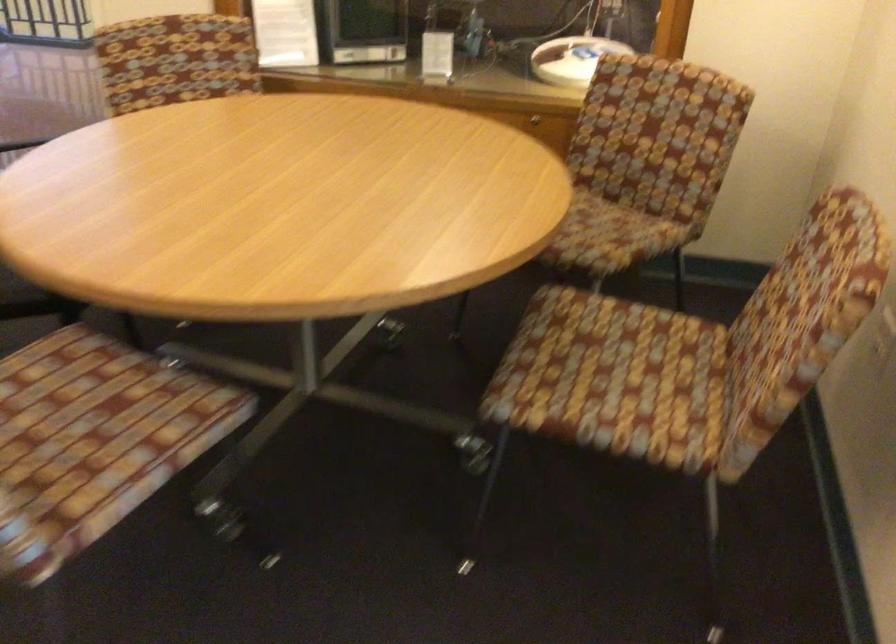
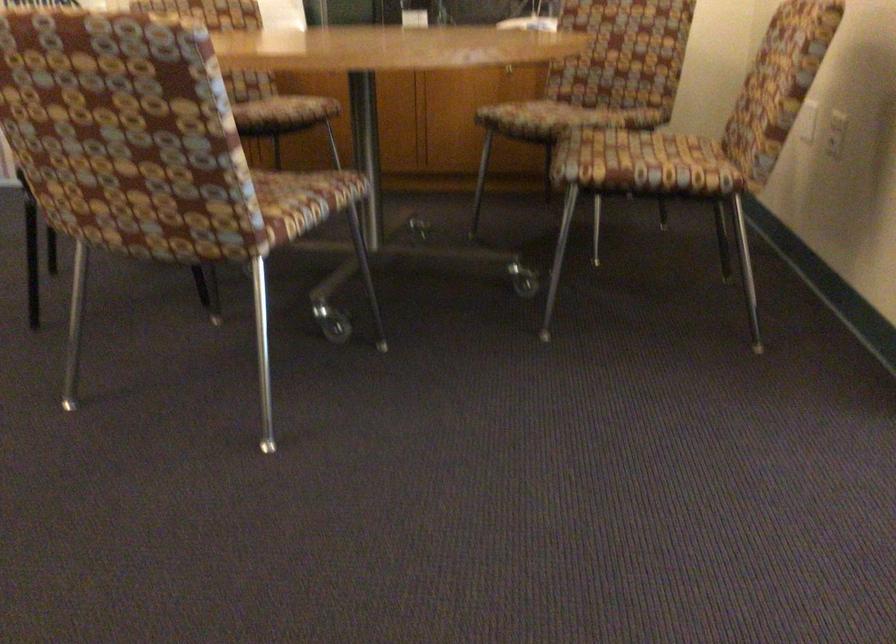
The point at (606, 404) is marked in the first image. Where is the corresponding point in the second image?

(643, 164)